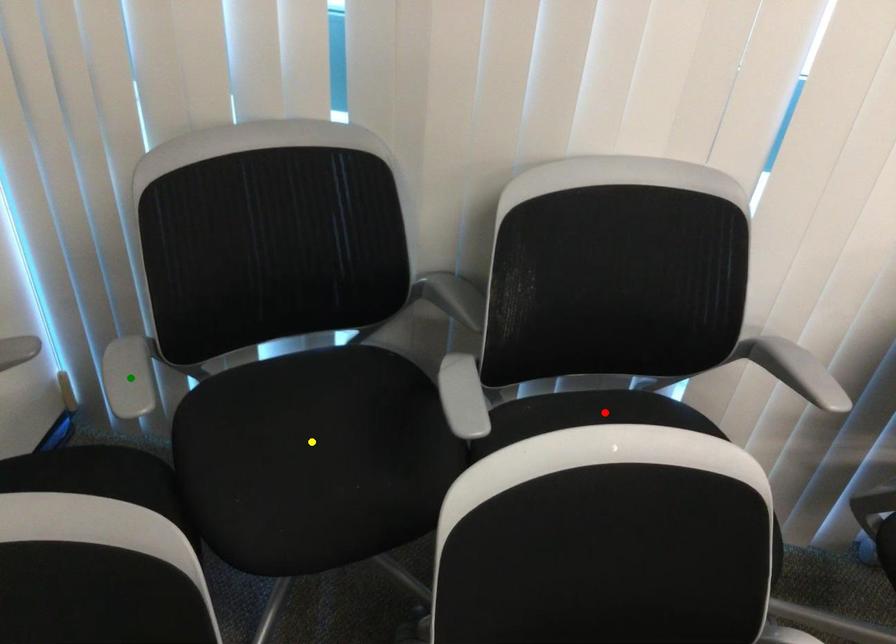
Consider the image. Order these from farthest to nearest:
- yellow point
- red point
- green point

red point
yellow point
green point